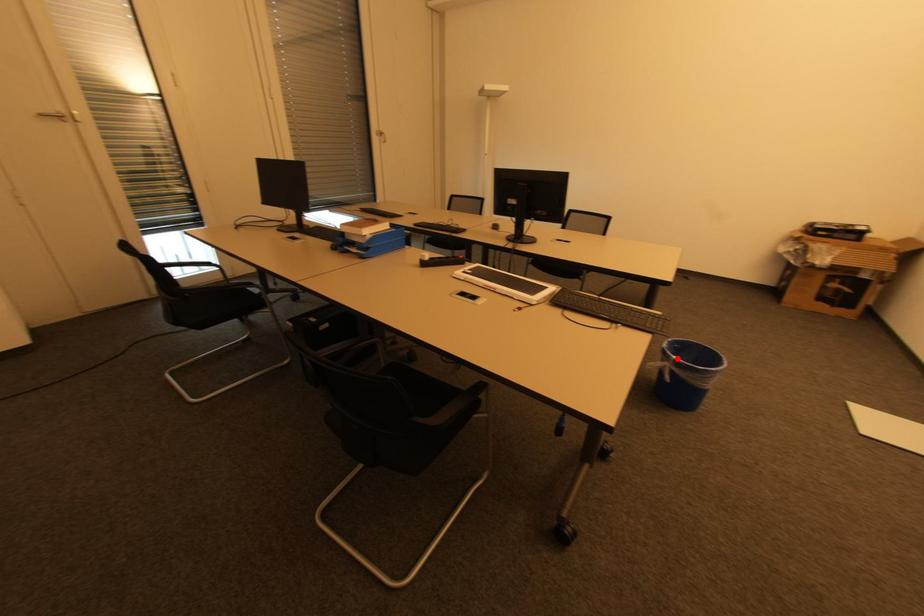
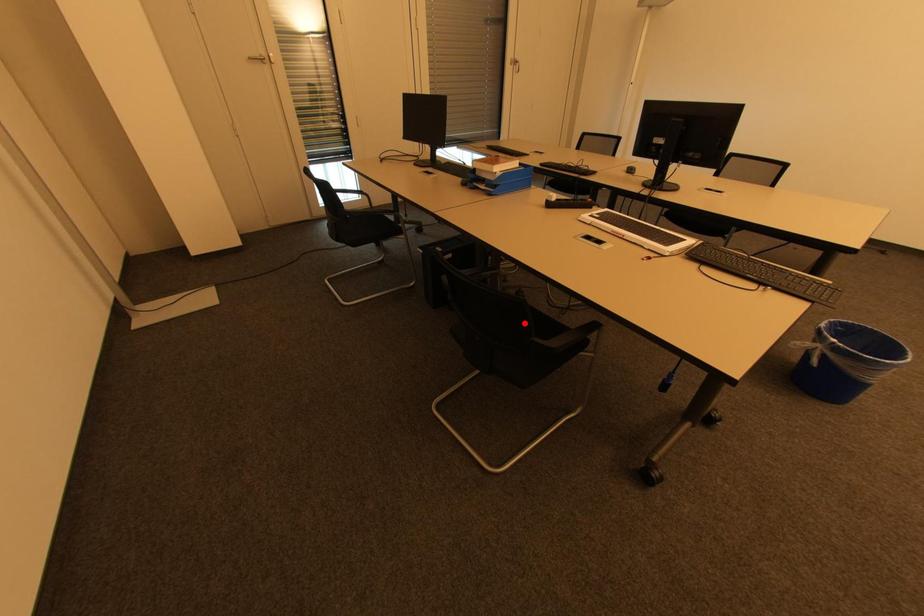
I am providing you with two images of the same scene from different viewpoints. A red point is marked on the first image and another point is marked on the second image. Do the highlighted points in image1 and image2 indicate the same real-world spot?

No